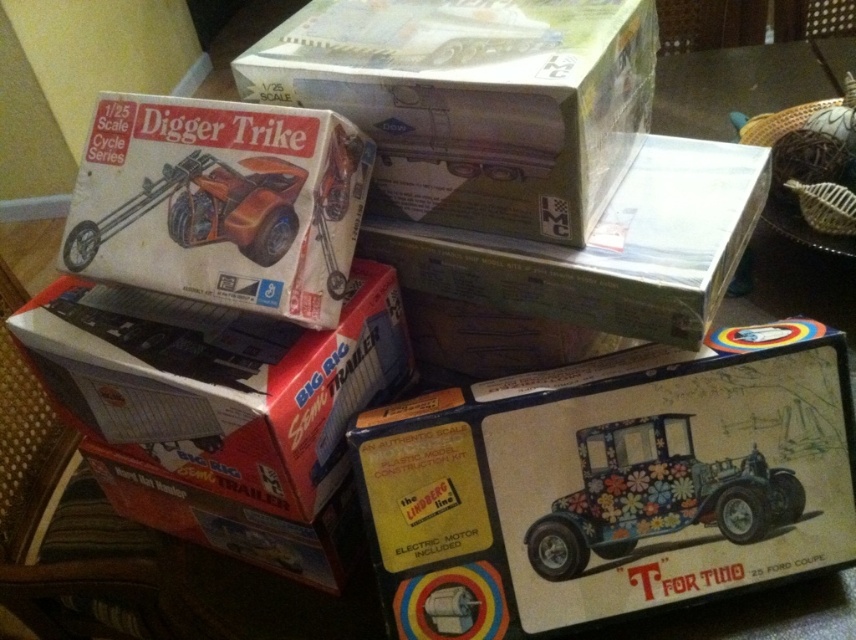
You are trying to fit both the matte cardboard box at upper center and the metallic orange trike at upper left into a storage container that is 8 inches wide. Can they fit side by side without overlapping?

The matte cardboard box at upper center and the metallic orange trike at upper left are 7.33 inches apart from each other, so they can fit side by side in the 8 inch wide container since the combined width is less than 8 inches.

Looking at this image, what are the coordinates of the matte cardboard box at upper center?

The matte cardboard box at upper center is located at coordinates point (474, 100).